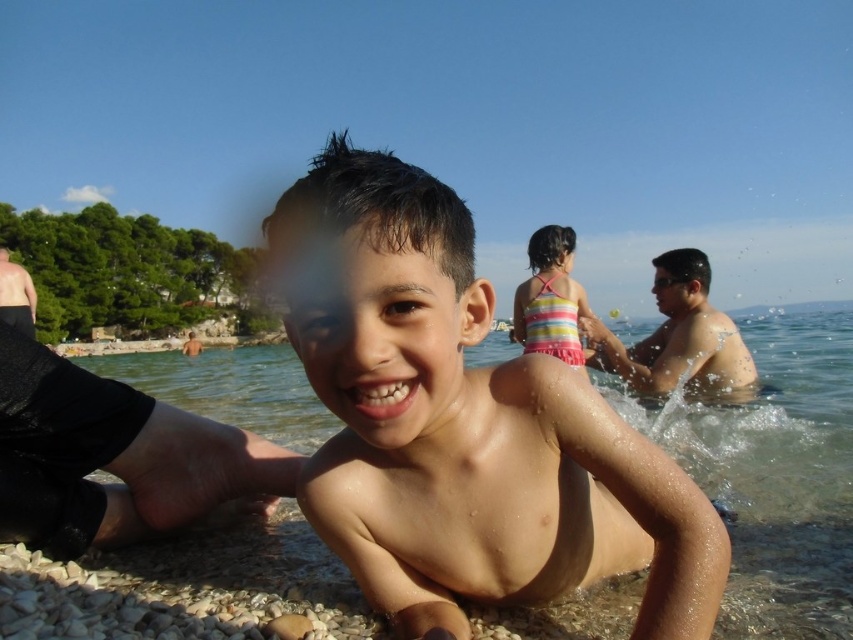
You are a photographer trying to capture a photo of the smooth skin boy at center and the striped fabric swimsuit at center. To ensure both are in focus, you need to know their positions relative to each other. Which object is positioned to the right side?

The smooth skin boy at center is positioned to the right of the striped fabric swimsuit at center.

You are a photographer trying to capture the wet skin boy at center and the clear water at boy front in the same frame. Considering their sizes, which one would you need to zoom in more on to make them appear equally sized in the photo?

The wet skin boy at center has a smaller size compared to the clear water at boy front, so you would need to zoom in more on the wet skin boy at center to make them appear equally sized in the photo.

You are a photographer trying to capture the boy and the water in the scene. Since the wet skin boy at center and the clear water at boy front are both in the frame, which one would appear narrower in the photo?

The wet skin boy at center is thinner than the clear water at boy front, so the wet skin boy at center would appear narrower in the photo.